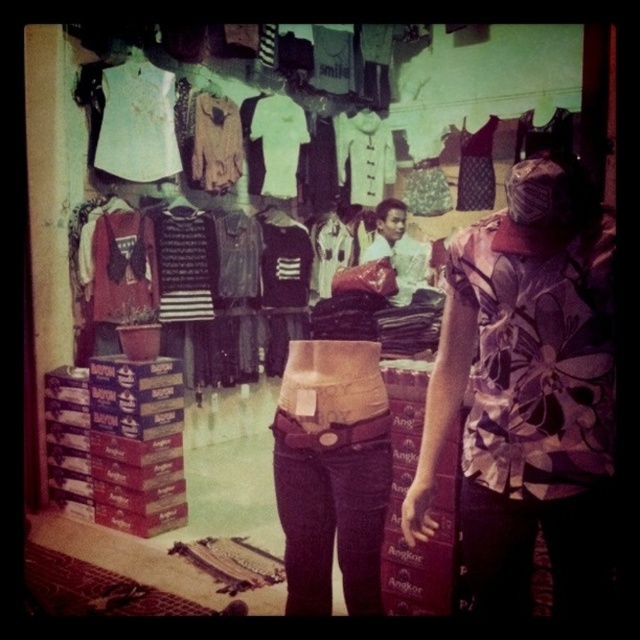
Who is higher up, black striped sweater at center or white textured shirt at center?

white textured shirt at center is higher up.

Find the location of a particular element. black striped sweater at center is located at coordinates (184, 264).

You are a GUI agent. You are given a task and a screenshot of the screen. Output one action in this format:
    pyautogui.click(x=<x>, y=<y>)
    Task: Click on the black striped sweater at center
    This screenshot has height=640, width=640.
    Given the screenshot: What is the action you would take?
    pyautogui.click(x=184, y=264)

What do you see at coordinates (536, 410) in the screenshot?
I see `floral-patterned fabric at center-right` at bounding box center [536, 410].

This screenshot has width=640, height=640. In order to click on floral-patterned fabric at center-right in this screenshot , I will do point(536,410).

Does white matte shirt at upper left appear under light beige fabric skirt at center?

Incorrect, white matte shirt at upper left is not positioned below light beige fabric skirt at center.

Can you confirm if white matte shirt at upper left is positioned above light beige fabric skirt at center?

Yes.

Is point (145, 77) positioned after point (317, 289)?

No, it is not.

Locate an element on the screen. The height and width of the screenshot is (640, 640). white matte shirt at upper left is located at coordinates (138, 124).